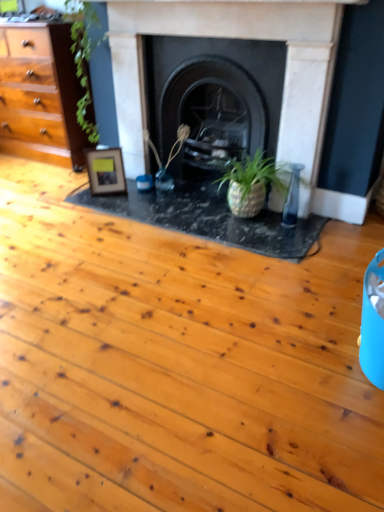
Question: Could you tell me if black stone fireplace at center, the 2th fireplace when ordered from left to right, is facing marble fireplace at center, which ranks as the 1th fireplace in left-to-right order?

Choices:
 (A) no
 (B) yes

Answer: (B)

Question: From the image's perspective, is black stone fireplace at center, arranged as the first fireplace when viewed from the right, beneath marble fireplace at center, which ranks as the 1th fireplace in left-to-right order?

Choices:
 (A) no
 (B) yes

Answer: (A)

Question: Are black stone fireplace at center, arranged as the first fireplace when viewed from the right, and marble fireplace at center, which ranks as the 1th fireplace in left-to-right order, beside each other?

Choices:
 (A) no
 (B) yes

Answer: (A)

Question: Is black stone fireplace at center, the 2th fireplace when ordered from left to right, outside marble fireplace at center, the second fireplace in the right-to-left sequence?

Choices:
 (A) no
 (B) yes

Answer: (B)

Question: From a real-world perspective, is black stone fireplace at center, the 2th fireplace when ordered from left to right, located beneath marble fireplace at center, the second fireplace in the right-to-left sequence?

Choices:
 (A) yes
 (B) no

Answer: (A)

Question: Is black stone fireplace at center, the 2th fireplace when ordered from left to right, taller or shorter than green matte plant at center?

Choices:
 (A) short
 (B) tall

Answer: (B)

Question: Does point (185, 53) appear closer or farther from the camera than point (155, 156)?

Choices:
 (A) closer
 (B) farther

Answer: (A)

Question: Considering the positions of black stone fireplace at center, the 2th fireplace when ordered from left to right, and green matte plant at center in the image, is black stone fireplace at center, the 2th fireplace when ordered from left to right, wider or thinner than green matte plant at center?

Choices:
 (A) thin
 (B) wide

Answer: (B)

Question: Considering the relative positions of black stone fireplace at center, arranged as the first fireplace when viewed from the right, and green matte plant at center in the image provided, is black stone fireplace at center, arranged as the first fireplace when viewed from the right, to the left or to the right of green matte plant at center?

Choices:
 (A) left
 (B) right

Answer: (B)

Question: From the image's perspective, is marble fireplace at center, which ranks as the 1th fireplace in left-to-right order, above or below wooden photo frame at center left?

Choices:
 (A) below
 (B) above

Answer: (B)

Question: Does point (238, 19) appear closer or farther from the camera than point (99, 167)?

Choices:
 (A) closer
 (B) farther

Answer: (A)

Question: From their relative heights in the image, would you say marble fireplace at center, the second fireplace in the right-to-left sequence, is taller or shorter than wooden photo frame at center left?

Choices:
 (A) tall
 (B) short

Answer: (A)

Question: Considering their positions, is marble fireplace at center, the second fireplace in the right-to-left sequence, located in front of or behind wooden photo frame at center left?

Choices:
 (A) front
 (B) behind

Answer: (A)

Question: From the image's perspective, relative to black stone fireplace at center, arranged as the first fireplace when viewed from the right, is marble fireplace at center, which ranks as the 1th fireplace in left-to-right order, above or below?

Choices:
 (A) below
 (B) above

Answer: (A)

Question: From a real-world perspective, is marble fireplace at center, which ranks as the 1th fireplace in left-to-right order, positioned above or below black stone fireplace at center, the 2th fireplace when ordered from left to right?

Choices:
 (A) above
 (B) below

Answer: (A)